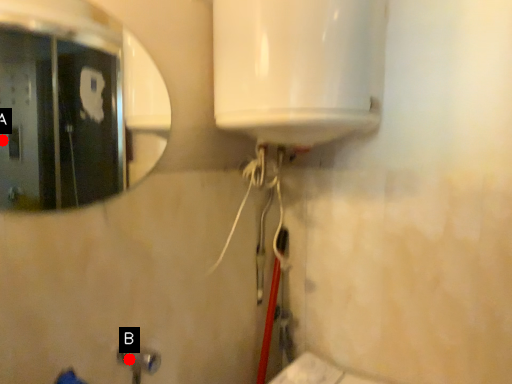
Question: Two points are circled on the image, labeled by A and B beside each circle. Among these points, which one is nearest to the camera?

Choices:
 (A) A is closer
 (B) B is closer

Answer: (B)